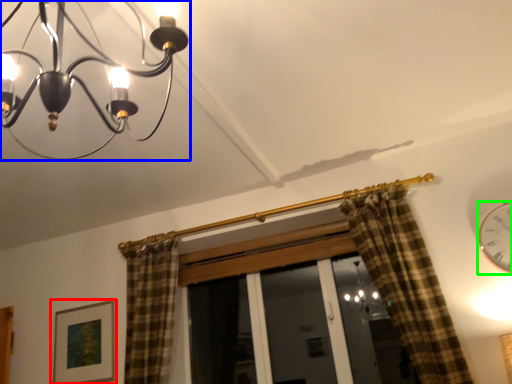
Question: Considering the real-world distances, which object is farthest from picture frame (highlighted by a red box)? lamp (highlighted by a blue box) or clock (highlighted by a green box)?

Choices:
 (A) lamp
 (B) clock

Answer: (B)